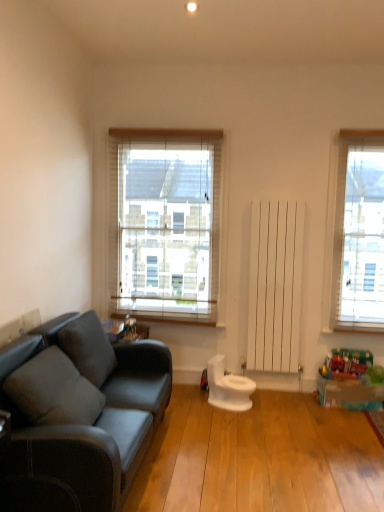
This screenshot has width=384, height=512. What are the coordinates of `vacant position to the left of white glossy toilet at center` in the screenshot? It's located at (183, 401).